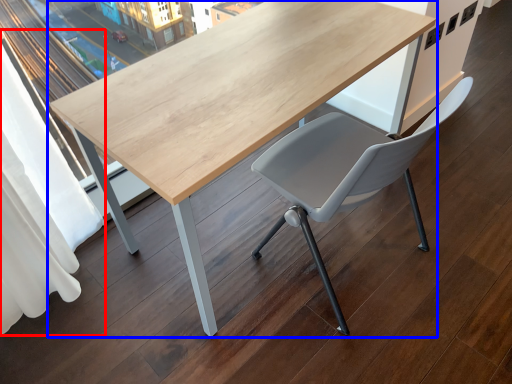
Question: Among these objects, which one is farthest to the camera, curtain (highlighted by a red box) or table (highlighted by a blue box)?

Choices:
 (A) curtain
 (B) table

Answer: (B)